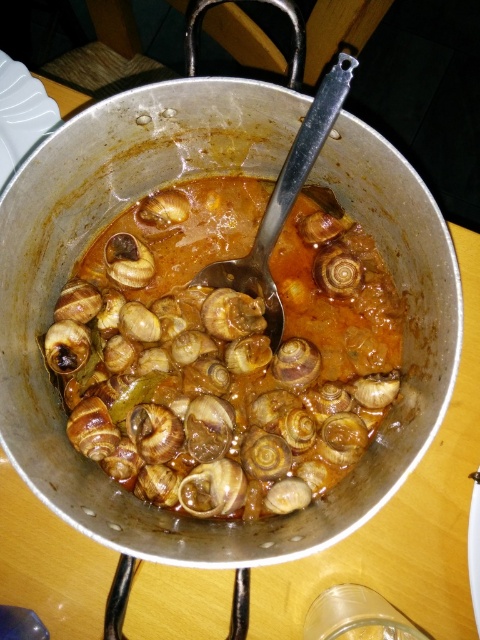
Question: Which object is closer to the camera taking this photo?

Choices:
 (A) matte brown snail at center
 (B) shiny brown snail at center

Answer: (B)

Question: In this image, where is shiny brown snail at center located relative to matte brown snail at center?

Choices:
 (A) below
 (B) above

Answer: (A)

Question: Among these objects, which one is nearest to the camera?

Choices:
 (A) shiny brown snail at center
 (B) matte brown snail at center

Answer: (A)

Question: Can you confirm if shiny brown snail at center is positioned to the left of matte brown snail at center?

Choices:
 (A) no
 (B) yes

Answer: (A)

Question: Is shiny brown snail at center below matte brown snail at center?

Choices:
 (A) yes
 (B) no

Answer: (A)